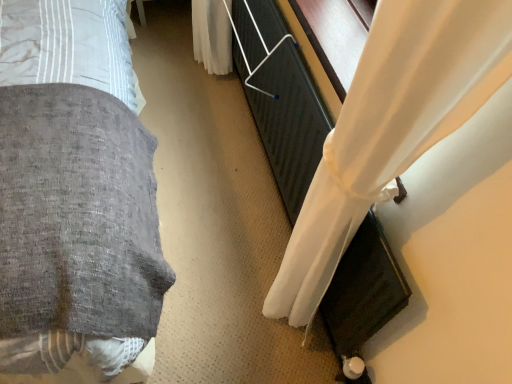
This screenshot has height=384, width=512. Find the location of `free space to the left of white sheer curtain at right`. free space to the left of white sheer curtain at right is located at coordinates (200, 148).